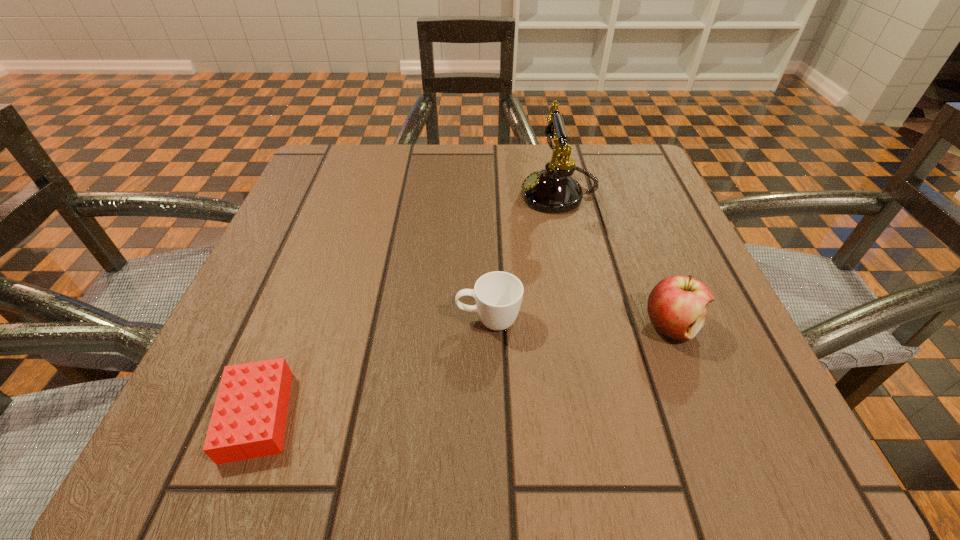
Where is `apple that is positioned at the right edge`? The image size is (960, 540). apple that is positioned at the right edge is located at coordinates (676, 306).

Find the location of a particular element. The width and height of the screenshot is (960, 540). object present at the near left corner is located at coordinates (248, 421).

Identify the location of object at the far right corner. The image size is (960, 540). (552, 190).

The width and height of the screenshot is (960, 540). I want to click on free space at the far edge of the desktop, so click(x=522, y=145).

Image resolution: width=960 pixels, height=540 pixels. Identify the location of vacant space at the near edge of the desktop. (487, 432).

At what (x,y) coordinates should I click in order to perform the action: click on free space at the left edge of the desktop. Please return your answer as a coordinate pair (x, y). Image resolution: width=960 pixels, height=540 pixels. Looking at the image, I should click on (320, 303).

Where is `blank space at the right edge of the desktop`? The height and width of the screenshot is (540, 960). blank space at the right edge of the desktop is located at coordinates (647, 247).

Identify the location of vacant space at the far left corner of the desktop. Image resolution: width=960 pixels, height=540 pixels. (367, 148).

In the image, there is a desktop. Identify the location of free space at the near right corner. point(666,463).

Locate an element on the screen. free space that is in between the third tallest object and the Lego is located at coordinates (372, 368).